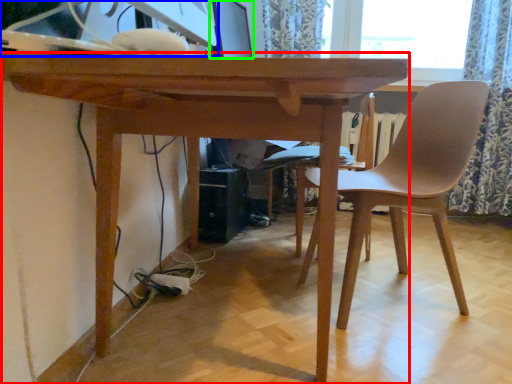
Question: Considering the real-world distances, which object is farthest from table (highlighted by a red box)? desktop computer (highlighted by a blue box) or computer monitor (highlighted by a green box)?

Choices:
 (A) desktop computer
 (B) computer monitor

Answer: (B)